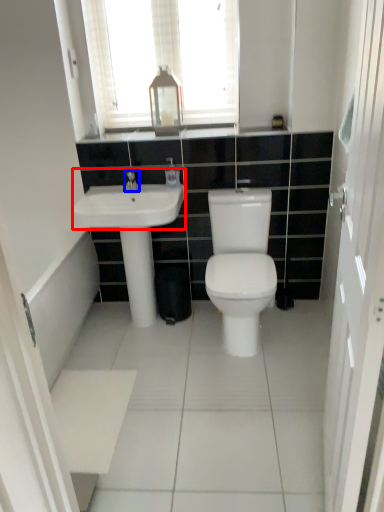
Question: Which of the following is the farthest to the observer, sink (highlighted by a red box) or tap (highlighted by a blue box)?

Choices:
 (A) sink
 (B) tap

Answer: (B)